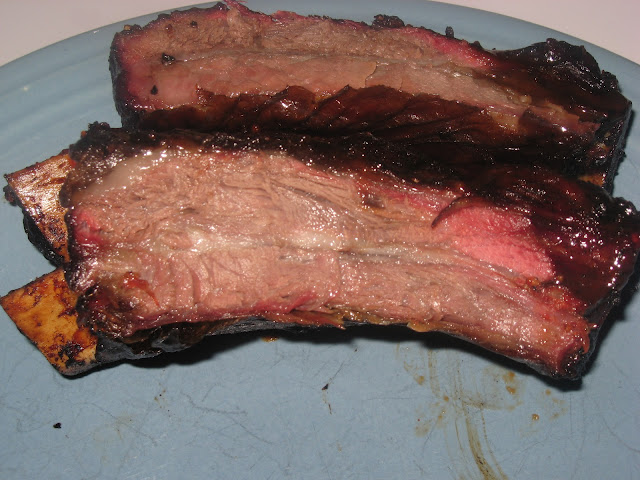
Where is `table`? table is located at coordinates (589, 24), (18, 14).